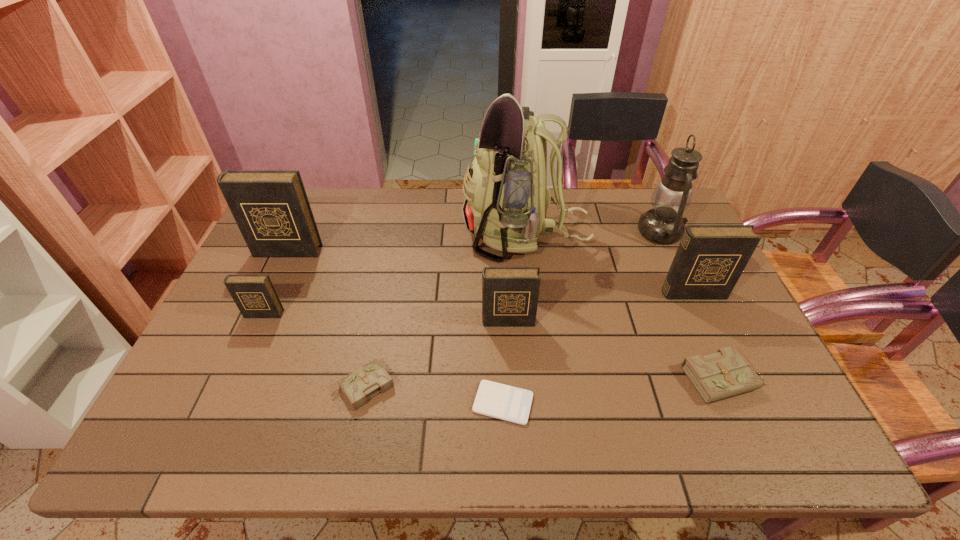
Where is `vacant region that satisfies the following two spatial constraints: 1. on the front-facing side of the tallest object; 2. on the front cover of the fourth tallest diary`? This screenshot has width=960, height=540. vacant region that satisfies the following two spatial constraints: 1. on the front-facing side of the tallest object; 2. on the front cover of the fourth tallest diary is located at coordinates pos(535,314).

Locate an element on the screen. free space that satisfies the following two spatial constraints: 1. on the front cover of the farthest dark diary; 2. on the right side of the right green diary is located at coordinates tap(228, 379).